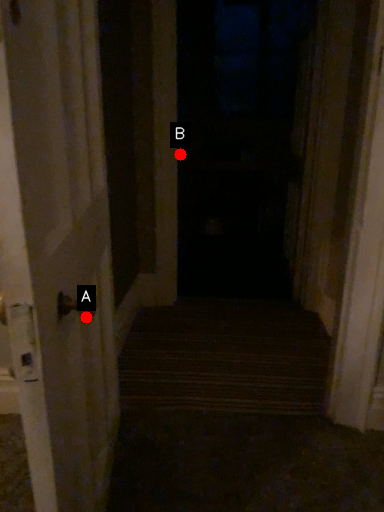
Question: Two points are circled on the image, labeled by A and B beside each circle. Among these points, which one is nearest to the camera?

Choices:
 (A) A is closer
 (B) B is closer

Answer: (A)